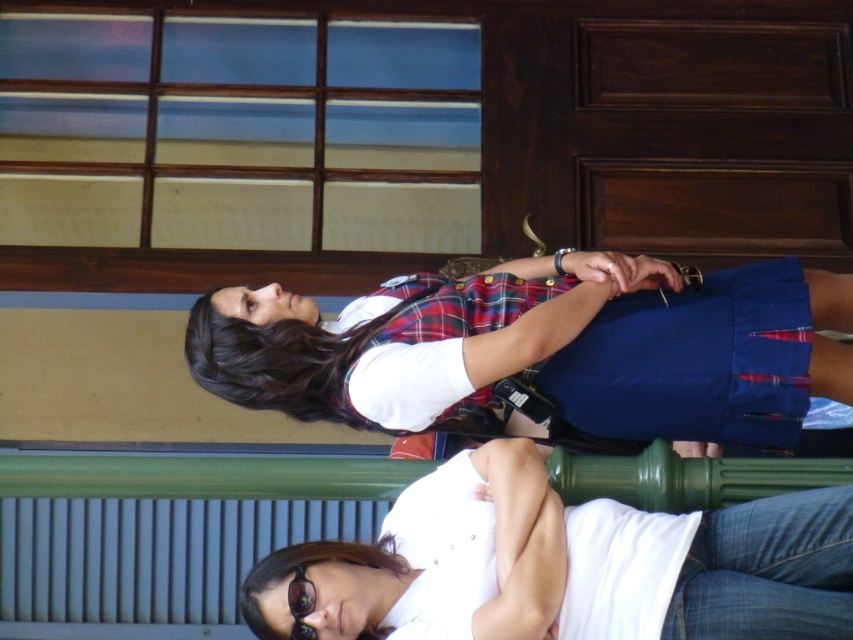
Question: Which object is closer to the camera taking this photo?

Choices:
 (A) translucent plastic goggles at lower center
 (B) matte plaid vest at center
 (C) white cotton shirt at center

Answer: (C)

Question: Does matte plaid vest at center appear on the right side of white cotton shirt at center?

Choices:
 (A) no
 (B) yes

Answer: (A)

Question: Based on their relative distances, which object is nearer to the matte plaid vest at center?

Choices:
 (A) white cotton shirt at center
 (B) translucent plastic goggles at lower center

Answer: (A)

Question: Does matte plaid vest at center appear on the left side of translucent plastic goggles at lower center?

Choices:
 (A) no
 (B) yes

Answer: (A)

Question: Which object is farther from the camera taking this photo?

Choices:
 (A) white cotton shirt at center
 (B) translucent plastic goggles at lower center
 (C) matte plaid vest at center

Answer: (C)

Question: Can you confirm if matte plaid vest at center is positioned below translucent plastic goggles at lower center?

Choices:
 (A) no
 (B) yes

Answer: (A)